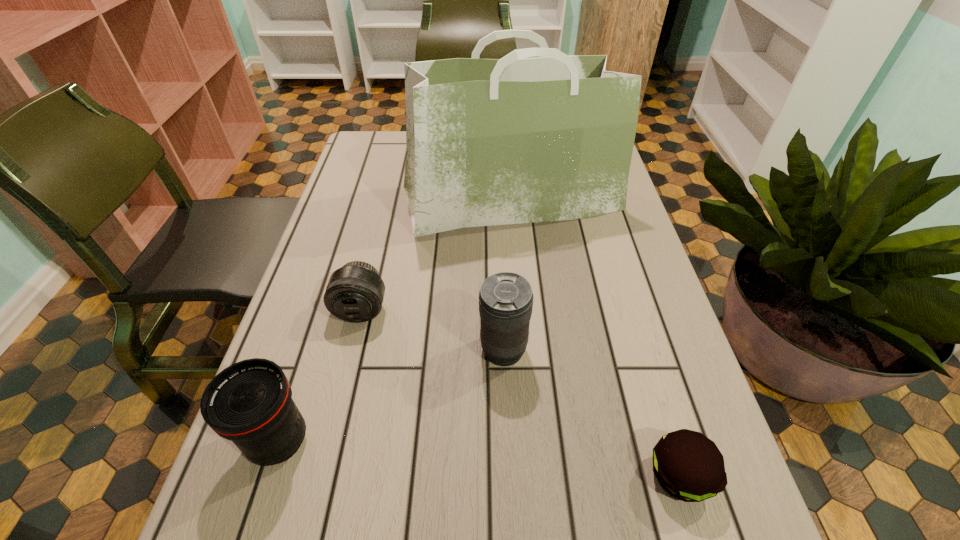
I want to click on the farthest object, so click(503, 141).

The height and width of the screenshot is (540, 960). In order to click on grocery bag in this screenshot , I will do `click(503, 141)`.

The width and height of the screenshot is (960, 540). I want to click on the third farthest object, so click(505, 299).

In order to click on the rightmost telephoto lens in this screenshot , I will do `click(505, 299)`.

Identify the location of the nearest telephoto lens. The width and height of the screenshot is (960, 540). (250, 402).

Identify the location of the second shortest object. This screenshot has height=540, width=960. (355, 292).

Locate an element on the screen. the farthest telephoto lens is located at coordinates (355, 292).

Find the location of a particular element. the shortest object is located at coordinates (689, 466).

At what (x,y) coordinates should I click in order to perform the action: click on free location located 0.090m on the front of the grocery bag. Please return your answer as a coordinate pair (x, y). The image size is (960, 540). Looking at the image, I should click on (516, 264).

Image resolution: width=960 pixels, height=540 pixels. Identify the location of free space located 0.130m on the side of the rightmost telephoto lens where the control switches are located. (414, 350).